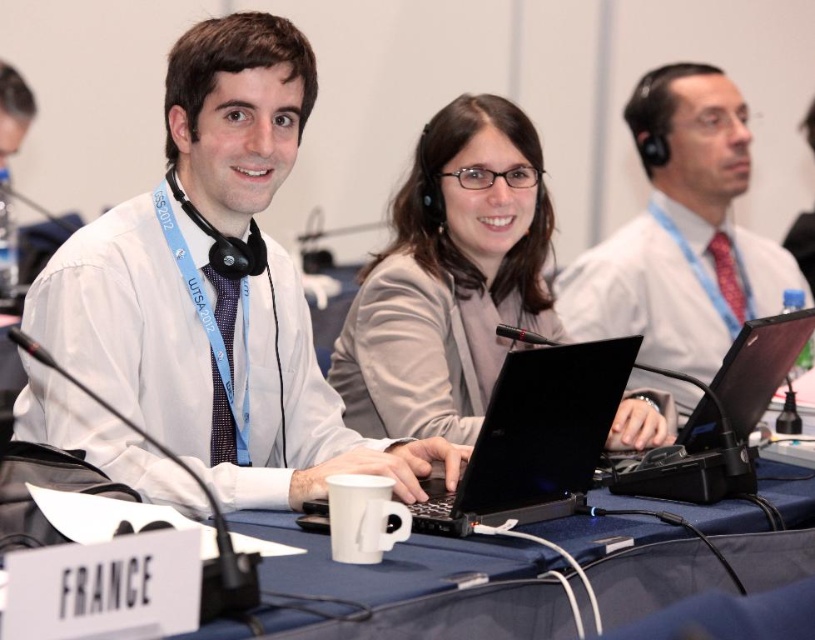
Question: Which point is closer to the camera?

Choices:
 (A) (747, 356)
 (B) (435, 497)
 (C) (514, 596)
 (D) (787, 257)

Answer: (C)

Question: Does white shirt at center have a greater width compared to matte gray blazer at center?

Choices:
 (A) no
 (B) yes

Answer: (B)

Question: Is white plastic table at center above black matte laptop at center?

Choices:
 (A) yes
 (B) no

Answer: (B)

Question: Which object is the farthest from the black matte laptop at center?

Choices:
 (A) white plastic table at center
 (B) matte gray blazer at center
 (C) black plastic laptop at center

Answer: (B)

Question: Is matte gray blazer at center above white plastic table at center?

Choices:
 (A) yes
 (B) no

Answer: (A)

Question: Which of the following is the farthest from the observer?

Choices:
 (A) black plastic laptop at center
 (B) matte white shirt at center
 (C) matte gray blazer at center

Answer: (B)